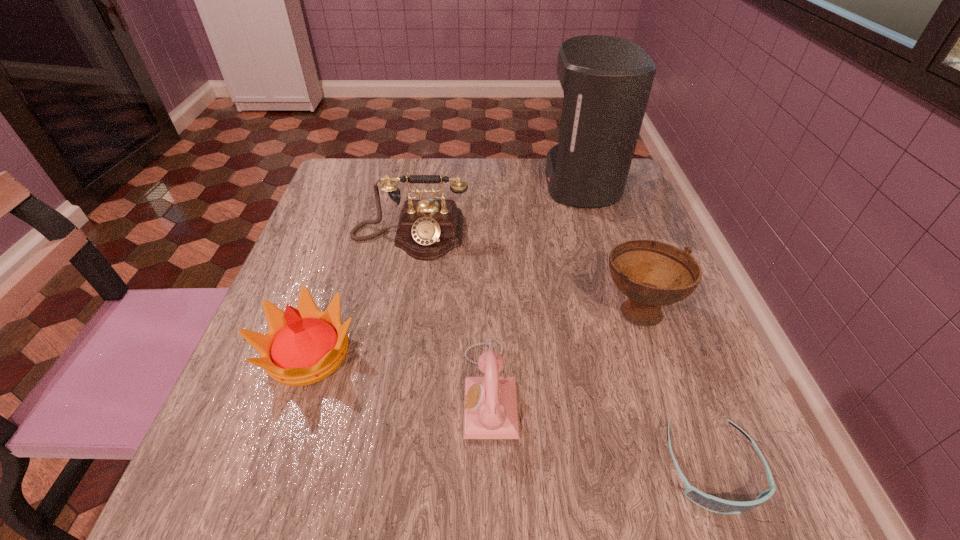
You are a GUI agent. You are given a task and a screenshot of the screen. Output one action in this format:
    pyautogui.click(x=<x>, y=<y>)
    Task: Click on the vacant space located 0.360m on the button side of the tallest object
    The width and height of the screenshot is (960, 540).
    Given the screenshot: What is the action you would take?
    pyautogui.click(x=407, y=183)

Identify the location of vacant space located 0.190m on the button side of the tallest object. (471, 183).

Locate an element on the screen. vacant space located 0.170m on the dial of the second farthest object is located at coordinates (394, 322).

Where is `vacant space situated on the back of the soup bowl`? The height and width of the screenshot is (540, 960). vacant space situated on the back of the soup bowl is located at coordinates (598, 193).

This screenshot has width=960, height=540. In order to click on vacant region located 0.300m on the right of the crown in this screenshot , I will do `click(533, 354)`.

This screenshot has height=540, width=960. Identify the location of vacant space located 0.090m on the dial of the nearer telephone. (408, 390).

This screenshot has height=540, width=960. I want to click on free space located on the dial of the nearer telephone, so click(339, 390).

Find the location of a particular element. The image size is (960, 540). vacant area located on the dial of the nearer telephone is located at coordinates (283, 390).

Locate an element on the screen. object present at the far edge is located at coordinates click(606, 80).

You are a GUI agent. You are given a task and a screenshot of the screen. Output one action in this format:
    pyautogui.click(x=<x>, y=<y>)
    Task: Click on the object located at the near edge
    
    Given the screenshot: What is the action you would take?
    pyautogui.click(x=708, y=502)